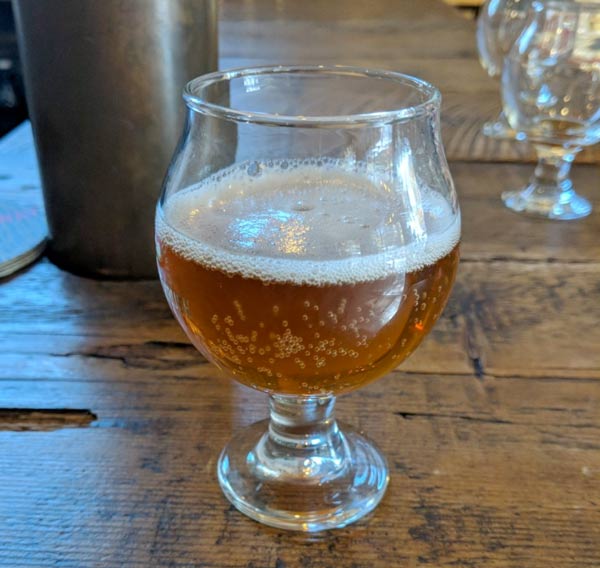
Find the location of a particular element. The width and height of the screenshot is (600, 568). bottom of cup is located at coordinates (302, 552).